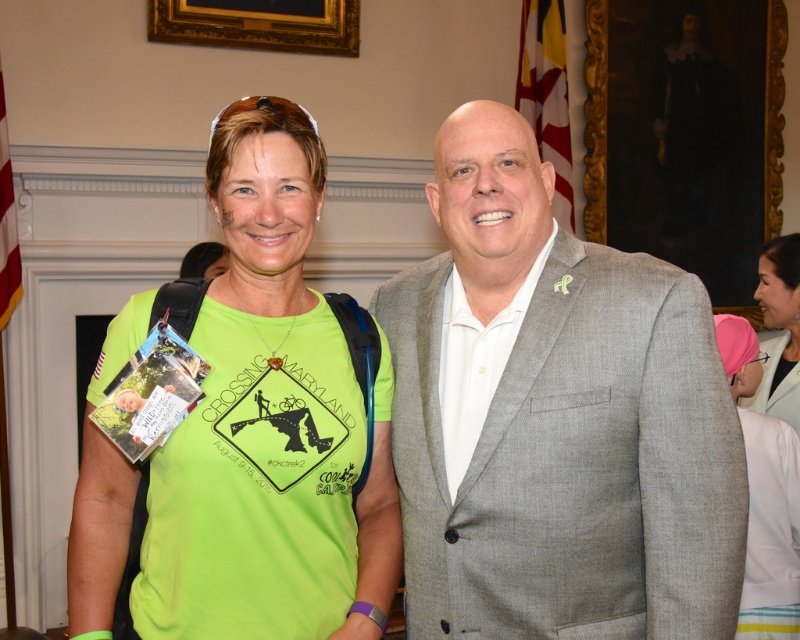
Question: Is pink fabric headscarf at upper right thinner than pink fabric at upper right?

Choices:
 (A) yes
 (B) no

Answer: (B)

Question: Which object is positioned closest to the pink fabric headscarf at upper right?

Choices:
 (A) gray textured suit at center
 (B) neon green t-shirt at center

Answer: (A)

Question: Does neon green t-shirt at center appear over pink fabric at upper right?

Choices:
 (A) no
 (B) yes

Answer: (A)

Question: Observing the image, what is the correct spatial positioning of gray textured suit at center in reference to pink fabric headscarf at upper right?

Choices:
 (A) below
 (B) above

Answer: (B)

Question: Among these points, which one is farthest from the camera?

Choices:
 (A) (768, 627)
 (B) (520, 259)
 (C) (316, 500)

Answer: (A)

Question: Considering the real-world distances, which object is closest to the pink fabric headscarf at upper right?

Choices:
 (A) neon green t-shirt at center
 (B) pink fabric at upper right
 (C) gray textured suit at center

Answer: (B)